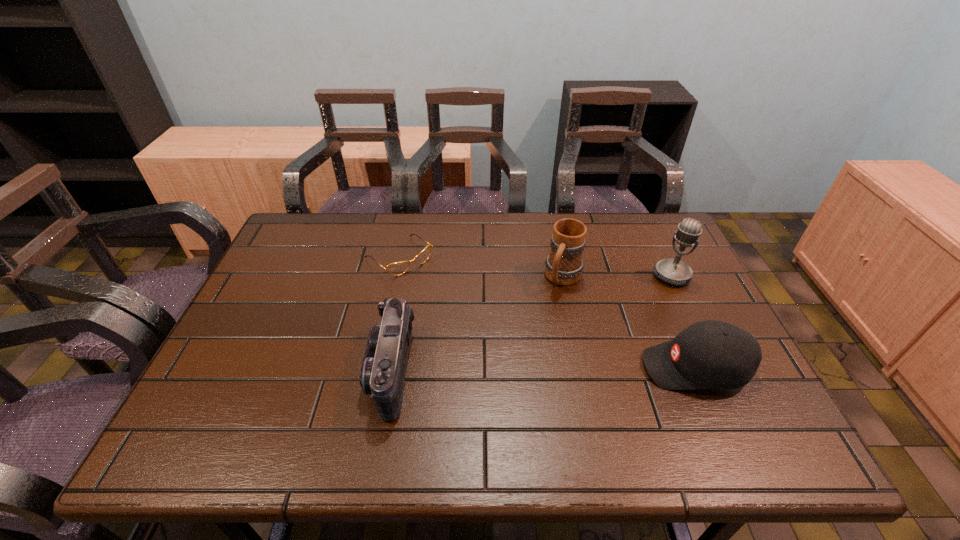
This screenshot has width=960, height=540. In order to click on free space at the right edge of the desktop in this screenshot , I will do `click(705, 294)`.

The image size is (960, 540). In the image, there is a desktop. Identify the location of free space at the far left corner. (311, 220).

I want to click on vacant space at the near left corner of the desktop, so click(252, 386).

This screenshot has width=960, height=540. Identify the location of free space between the microphone and the third object from left to right. (617, 277).

In order to click on vacant space that is in between the baseball cap and the spectacles in this screenshot , I will do `click(547, 313)`.

Where is `empty location between the microphone and the camcorder`? The image size is (960, 540). empty location between the microphone and the camcorder is located at coordinates (532, 323).

The width and height of the screenshot is (960, 540). What are the coordinates of `free area in between the baseball cap and the second tallest object` in the screenshot? It's located at (630, 322).

Identify the location of blank region between the fourth shortest object and the baseball cap. (630, 322).

Image resolution: width=960 pixels, height=540 pixels. I want to click on blank region between the second tallest object and the camcorder, so click(477, 324).

Image resolution: width=960 pixels, height=540 pixels. I want to click on free area in between the camcorder and the second tallest object, so click(477, 324).